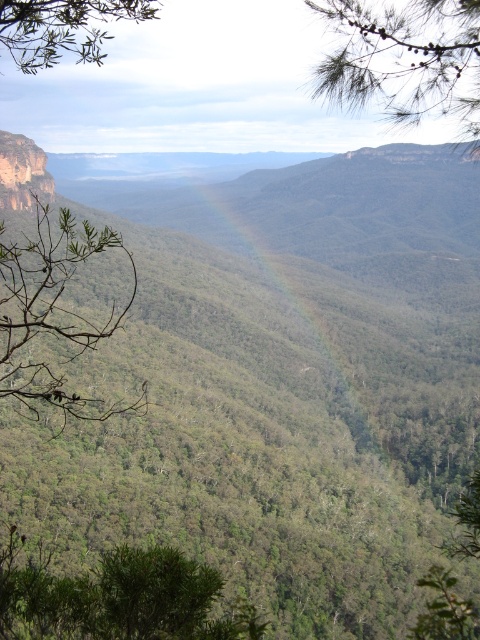
Question: Estimate the real-world distances between objects in this image. Which object is closer to the green leafy tree at lower center?

Choices:
 (A) green matte pine branch at upper right
 (B) green leafy branch at left
 (C) rainbow at center

Answer: (A)

Question: Does green leafy tree at lower center appear under green matte pine branch at upper right?

Choices:
 (A) no
 (B) yes

Answer: (B)

Question: Which point appears closest to the camera in this image?

Choices:
 (A) (204, 604)
 (B) (456, 12)
 (C) (36, 410)

Answer: (A)

Question: Which point appears farthest from the camera in this image?

Choices:
 (A) (51, 12)
 (B) (316, 8)
 (C) (264, 182)

Answer: (C)

Question: Does green leafy tree at lower center come in front of green leafy branch at upper left?

Choices:
 (A) no
 (B) yes

Answer: (B)

Question: Is green leafy tree at lower center in front of rainbow at center?

Choices:
 (A) no
 (B) yes

Answer: (B)